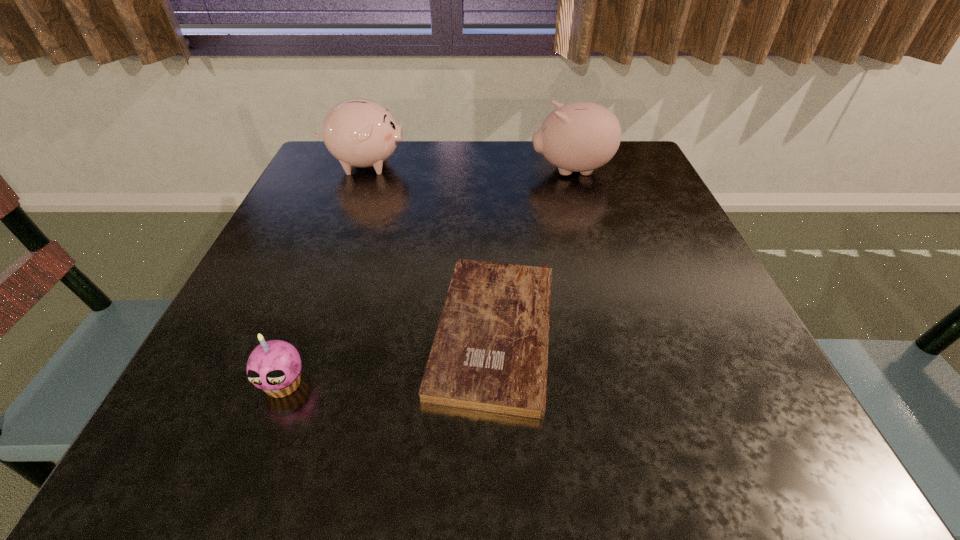
Identify the location of the right piggy bank. The image size is (960, 540). tap(581, 136).

Find the location of `the left piggy bank`. the left piggy bank is located at coordinates (358, 132).

You are a GUI agent. You are given a task and a screenshot of the screen. Output one action in this format:
    pyautogui.click(x=<x>, y=<y>)
    Task: Click on the cupcake
    
    Given the screenshot: What is the action you would take?
    pyautogui.click(x=276, y=361)

Identify the location of Bible. (490, 353).

Locate an element on the screen. free location located at the snout of the right piggy bank is located at coordinates (480, 171).

Locate an element on the screen. vacant space located at the snout of the right piggy bank is located at coordinates (415, 171).

Locate an element on the screen. The width and height of the screenshot is (960, 540). vacant space located at the snout of the right piggy bank is located at coordinates (431, 171).

Image resolution: width=960 pixels, height=540 pixels. I want to click on free space located 0.370m on the front of the left piggy bank, so click(x=314, y=295).

Where is `free space located 0.070m on the face of the third tallest object`? The height and width of the screenshot is (540, 960). free space located 0.070m on the face of the third tallest object is located at coordinates (257, 454).

Where is `vacant position located 0.260m on the back of the shortest object`? vacant position located 0.260m on the back of the shortest object is located at coordinates (490, 192).